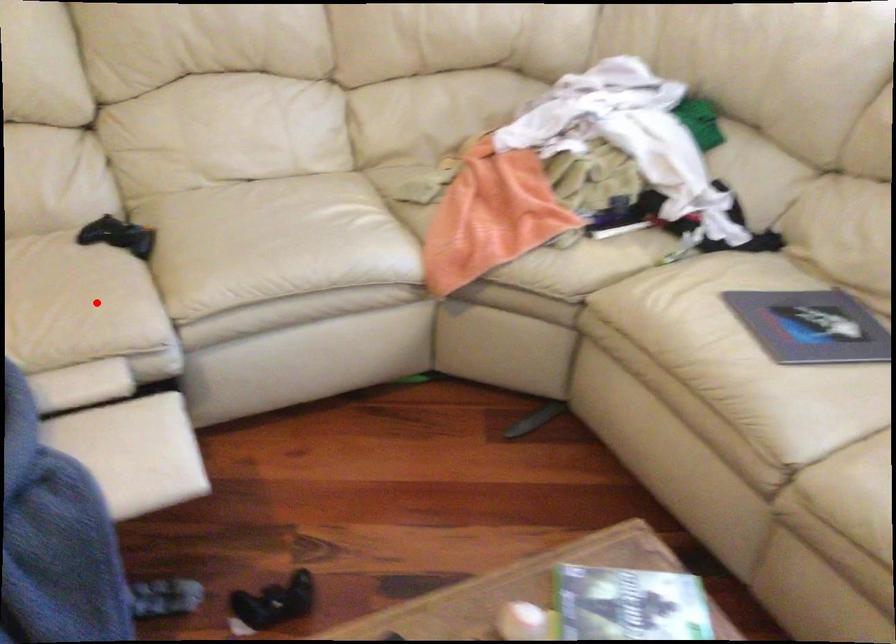
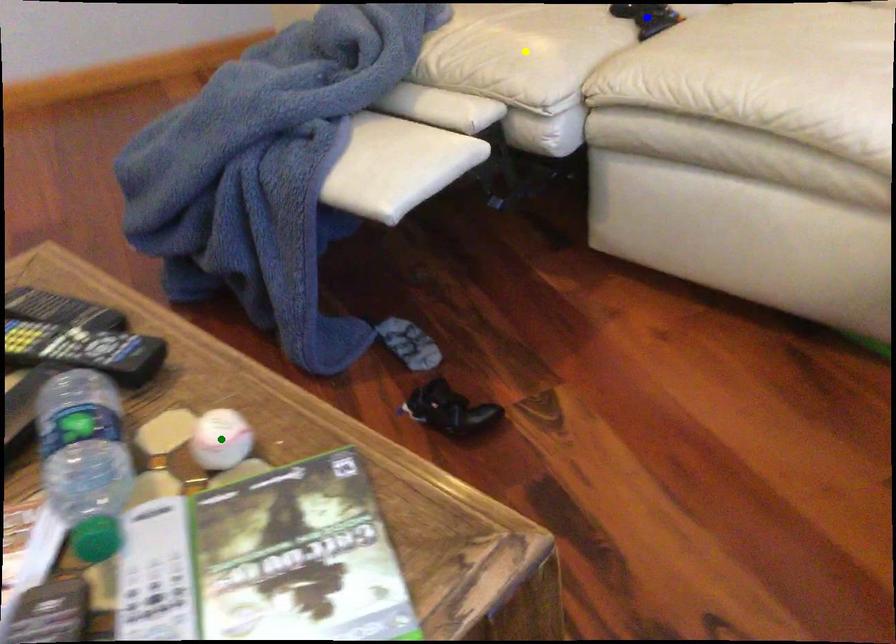
Question: I am providing you with two images of the same scene from different viewpoints. A red point is marked on the first image. You are given multiple points on the second image. Which point in image 2 is actually the same real-world point as the red point in image 1?

Choices:
 (A) blue point
 (B) yellow point
 (C) green point

Answer: (B)